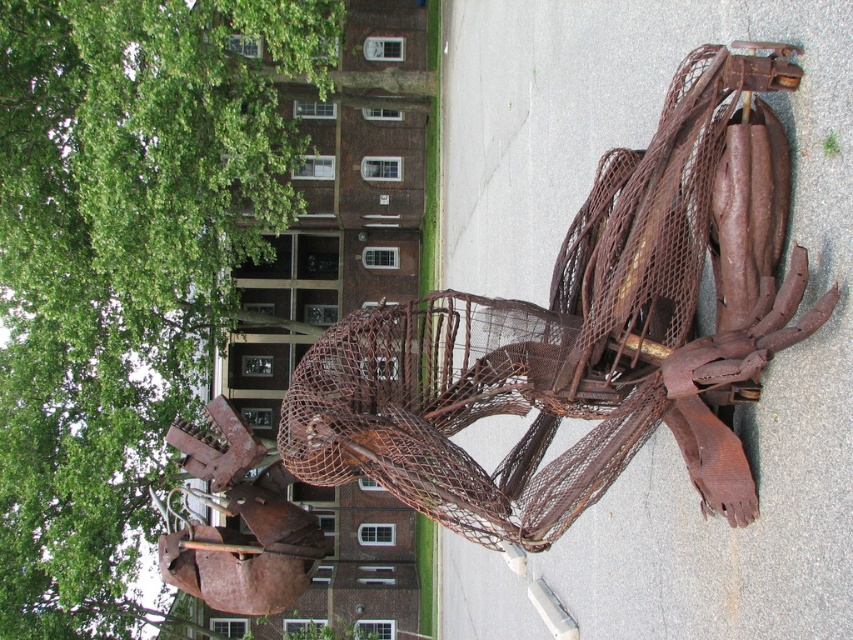
Between green leafy tree at upper left and rusty wire mesh sculpture at center, which one appears on the right side from the viewer's perspective?

Positioned to the right is rusty wire mesh sculpture at center.

Is green leafy tree at upper left thinner than rusty wire mesh sculpture at center?

No, green leafy tree at upper left is not thinner than rusty wire mesh sculpture at center.

Does point (32, 396) come farther from viewer compared to point (608, 394)?

Yes, it is.

Where is `green leafy tree at upper left`? The width and height of the screenshot is (853, 640). green leafy tree at upper left is located at coordinates (123, 262).